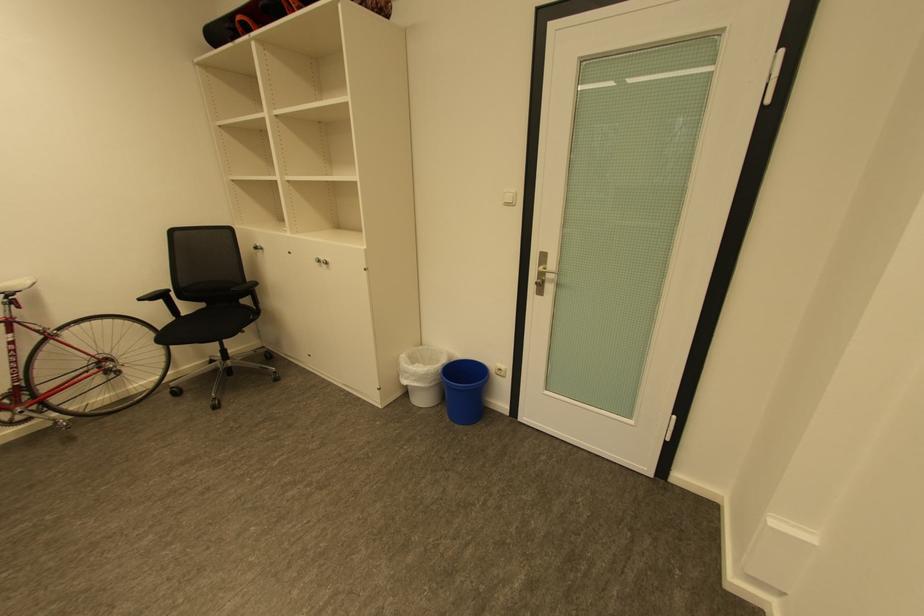
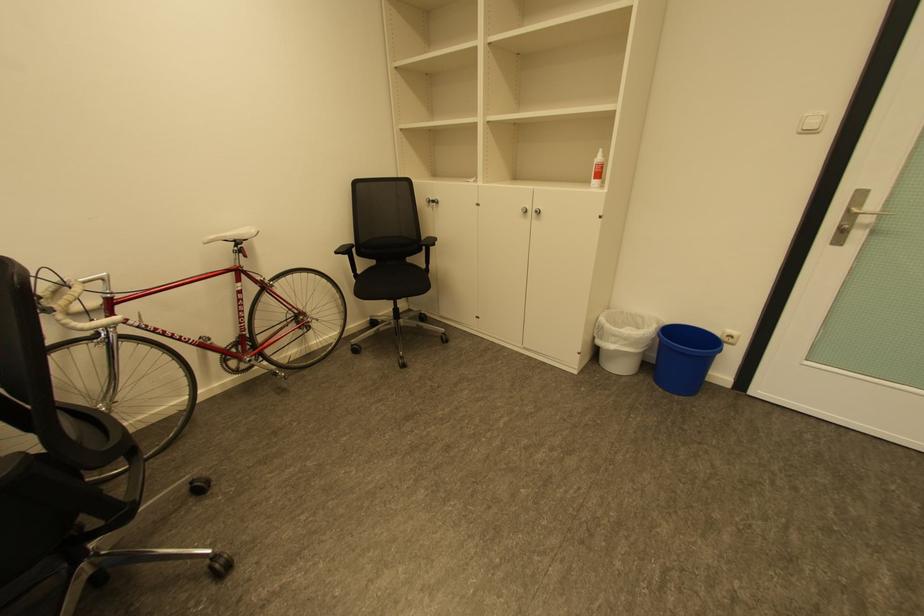
In the second image, find the point that corresponds to point 414,373 in the first image.

(622, 337)